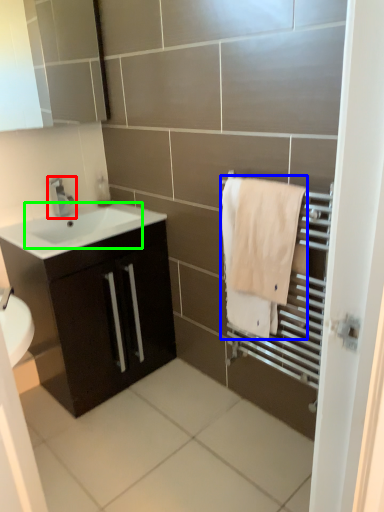
Question: Estimate the real-world distances between objects in this image. Which object is farther from tap (highlighted by a red box), bath towel (highlighted by a blue box) or sink (highlighted by a green box)?

Choices:
 (A) bath towel
 (B) sink

Answer: (A)